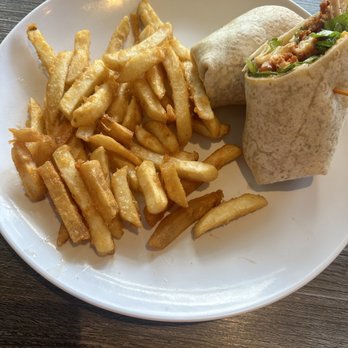
At what (x,y) coordinates should I click in order to perform the action: click on plate. Please return your answer as a coordinate pair (x, y). Looking at the image, I should click on (208, 19).